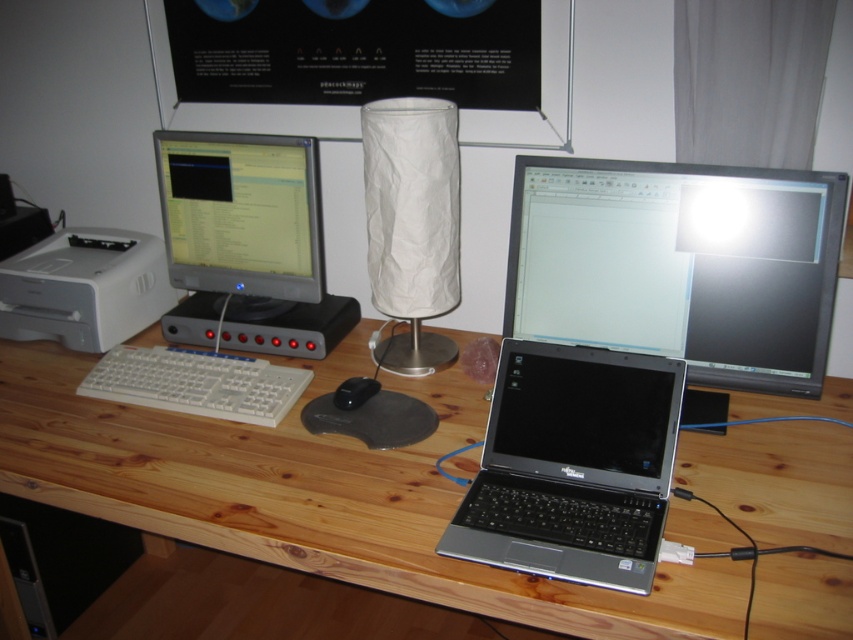
You are setting up a new monitor on the desk and need to place it between the white crumpled paper lampshade at center and the white plastic printer at left. Is there enough space between them to fit the monitor?

The white crumpled paper lampshade at center is located above the white plastic printer at left, so there is vertical space between them. However, since the monitor needs to be placed horizontally between them, the vertical positioning might not provide sufficient horizontal space. You should check the horizontal distance between them before placing the monitor.

You are organizing your desk and want to place a new item between the white crumpled paper lampshade at center and the white plastic keyboard at left. Which object should you place the new item closer to if you want it to be near the larger object?

The white crumpled paper lampshade at center is bigger than the white plastic keyboard at left, so you should place the new item closer to the white crumpled paper lampshade at center.

You are setting up a new monitor stand that requires at least 12 inches of vertical space. You have two options on the desk between the satin black laptop at lower right and the white plastic printer at left. Which object should you place the monitor stand next to to ensure it has enough vertical space?

The satin black laptop at lower right is much taller than the white plastic printer at left, so placing the monitor stand next to the satin black laptop at lower right would provide the required vertical space of at least 12 inches.